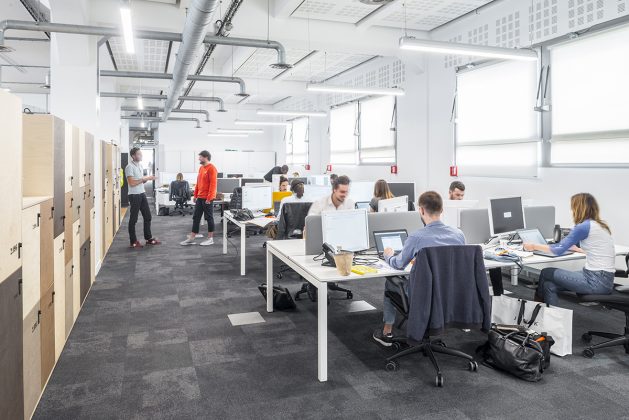
Where is `computer screens`? The width and height of the screenshot is (629, 420). computer screens is located at coordinates (513, 213), (390, 239), (363, 205), (259, 197), (230, 186).